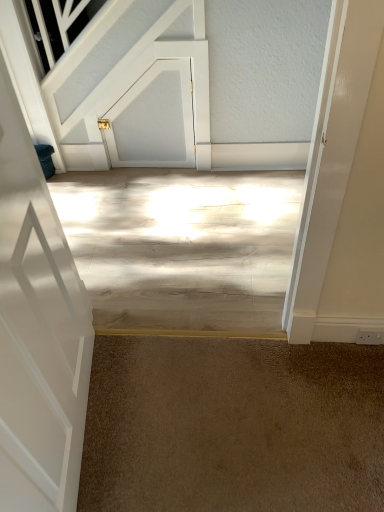
Question: From a real-world perspective, is brown carpet at lower center above or below white matte door at upper center, the 1th door viewed from the top?

Choices:
 (A) above
 (B) below

Answer: (B)

Question: Is brown carpet at lower center situated inside white matte door at upper center, the 2th door ordered from the bottom, or outside?

Choices:
 (A) inside
 (B) outside

Answer: (B)

Question: Which object is positioned farthest from the white glossy door at left, marked as the first door in a front-to-back arrangement?

Choices:
 (A) brown carpet at lower center
 (B) white matte door at upper center, the 2th door ordered from the bottom

Answer: (B)

Question: Which object is the farthest from the white matte door at upper center, the 2th door ordered from the bottom?

Choices:
 (A) white glossy door at left, acting as the 1th door starting from the bottom
 (B) brown carpet at lower center

Answer: (B)